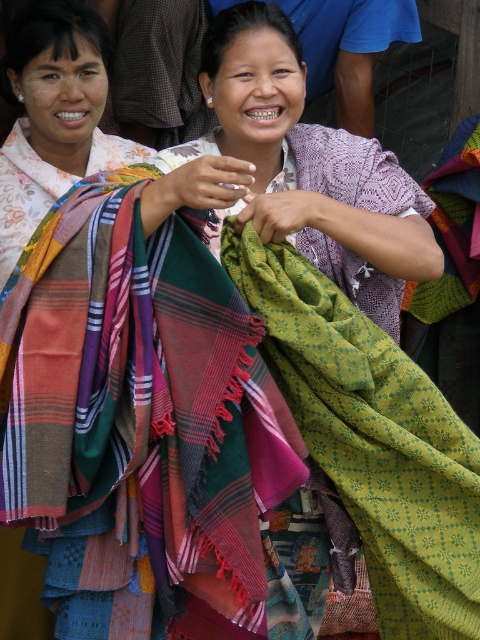
Question: Which point is closer to the camera?

Choices:
 (A) plaid fabric scarf at center
 (B) plaid wool scarf at center
 (C) green woven shawl at center

Answer: (A)

Question: Can you confirm if plaid fabric scarf at center is wider than plaid fabric scarf at left?

Choices:
 (A) yes
 (B) no

Answer: (A)

Question: Does plaid fabric scarf at center appear on the left side of plaid fabric scarf at left?

Choices:
 (A) no
 (B) yes

Answer: (A)

Question: Based on their relative distances, which object is nearer to the plaid fabric scarf at left?

Choices:
 (A) green woven shawl at center
 (B) plaid fabric scarf at center
 (C) plaid wool scarf at center

Answer: (B)

Question: Which of the following is the farthest from the observer?

Choices:
 (A) (418, 396)
 (B) (132, 275)
 (C) (334, 269)
 (D) (40, 563)

Answer: (D)

Question: Is plaid fabric scarf at center above plaid fabric scarf at left?

Choices:
 (A) yes
 (B) no

Answer: (B)